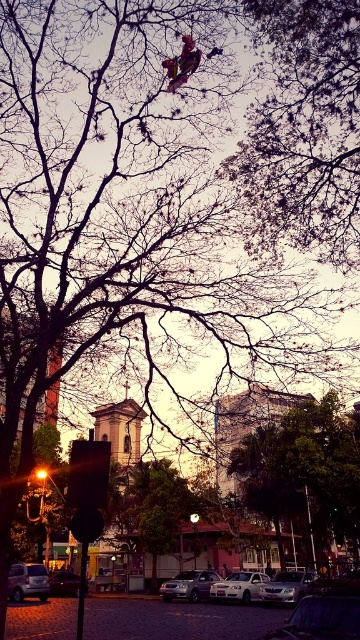
Question: Which of the following is the closest to the observer?

Choices:
 (A) (303, 582)
 (B) (176, 81)
 (C) (266, 234)

Answer: (B)

Question: Considering the real-world distances, which object is farthest from the metallic red skateboard at upper center?

Choices:
 (A) brown textured tree at upper center
 (B) metallic silver car at lower left
 (C) matte silver car at lower left

Answer: (B)

Question: Is the position of green leafy tree at center less distant than that of silver metallic car at center?

Choices:
 (A) no
 (B) yes

Answer: (A)

Question: Does brown textured tree at upper center appear on the right side of green leafy tree at center?

Choices:
 (A) yes
 (B) no

Answer: (B)

Question: Can you confirm if silver metallic suv at center is positioned to the left of metallic red skateboard at upper center?

Choices:
 (A) no
 (B) yes

Answer: (A)

Question: Which object is farther from the camera taking this photo?

Choices:
 (A) silver metallic suv at center
 (B) silver metallic car at lower center
 (C) metallic silver car at lower left

Answer: (C)